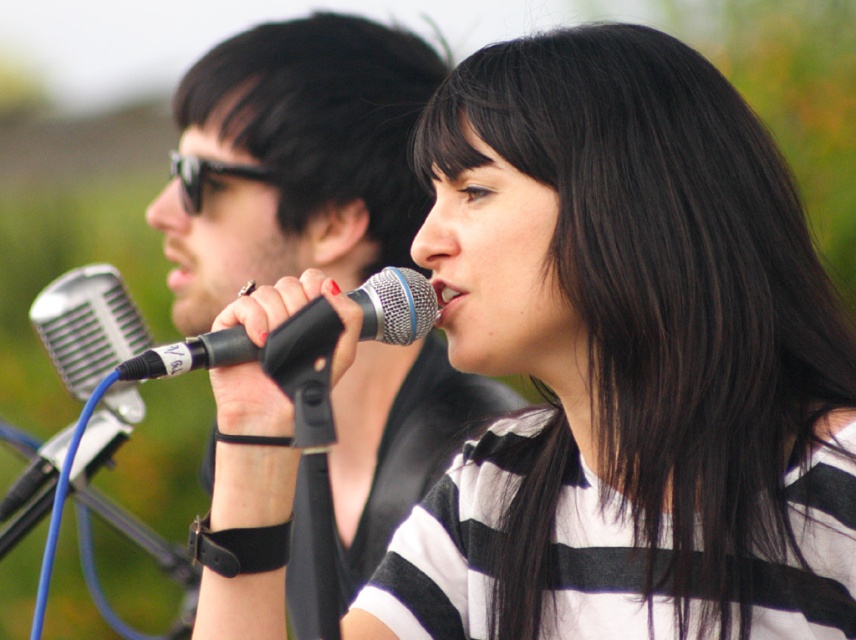
Question: Which point appears farthest from the camera in this image?

Choices:
 (A) (226, 282)
 (B) (325, 317)

Answer: (A)

Question: Is matte black microphone at left smaller than black metallic microphone at center?

Choices:
 (A) no
 (B) yes

Answer: (A)

Question: Does matte black microphone at left have a larger size compared to black plastic goggles at upper left?

Choices:
 (A) yes
 (B) no

Answer: (A)

Question: Which object appears closest to the camera in this image?

Choices:
 (A) black plastic goggles at upper left
 (B) matte black microphone at left
 (C) black striped shirt at center

Answer: (C)

Question: Based on their relative distances, which object is farther from the black metallic microphone at center?

Choices:
 (A) black plastic goggles at upper left
 (B) matte black microphone at left
 (C) black striped shirt at center

Answer: (A)

Question: Does black striped shirt at center lie in front of matte black microphone at left?

Choices:
 (A) yes
 (B) no

Answer: (A)